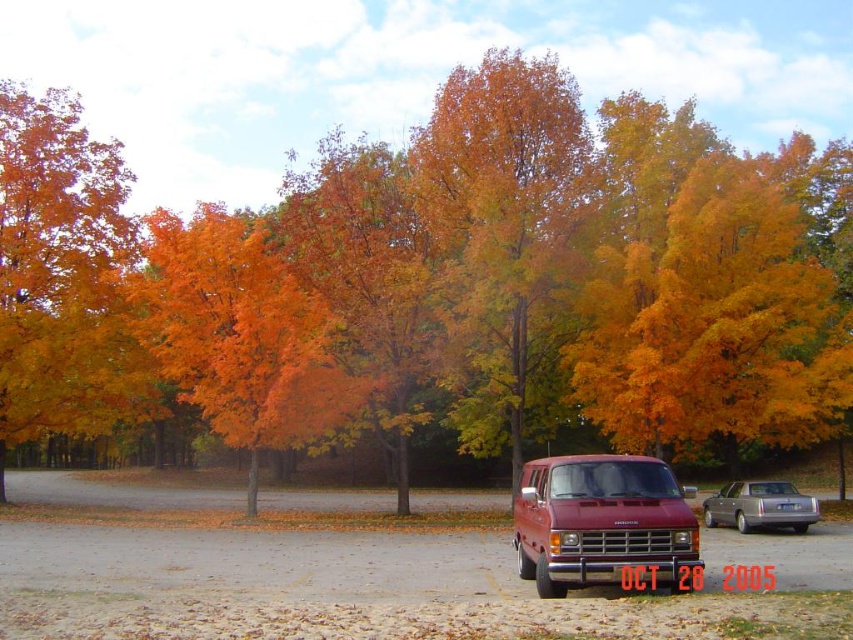
Question: Which object is farther from the camera taking this photo?

Choices:
 (A) orange matte tree at left
 (B) orange leafy tree at center
 (C) maroon metallic van at lower right

Answer: (A)

Question: Which of the following is the closest to the observer?

Choices:
 (A) maroon metallic van at lower right
 (B) golden textured leaves at center
 (C) orange matte tree at center

Answer: (A)

Question: Among these points, which one is nearest to the camera?

Choices:
 (A) tap(439, 356)
 (B) tap(119, 204)
 (C) tap(236, 412)
 (D) tap(560, 528)

Answer: (D)

Question: Does orange leafy tree at center come in front of orange matte tree at center?

Choices:
 (A) no
 (B) yes

Answer: (A)

Question: Can you confirm if golden textured leaves at center is positioned below orange matte tree at center?

Choices:
 (A) yes
 (B) no

Answer: (B)

Question: Where is maroon metallic van at lower right located in relation to metallic gray sedan at center right in the image?

Choices:
 (A) below
 (B) above

Answer: (B)